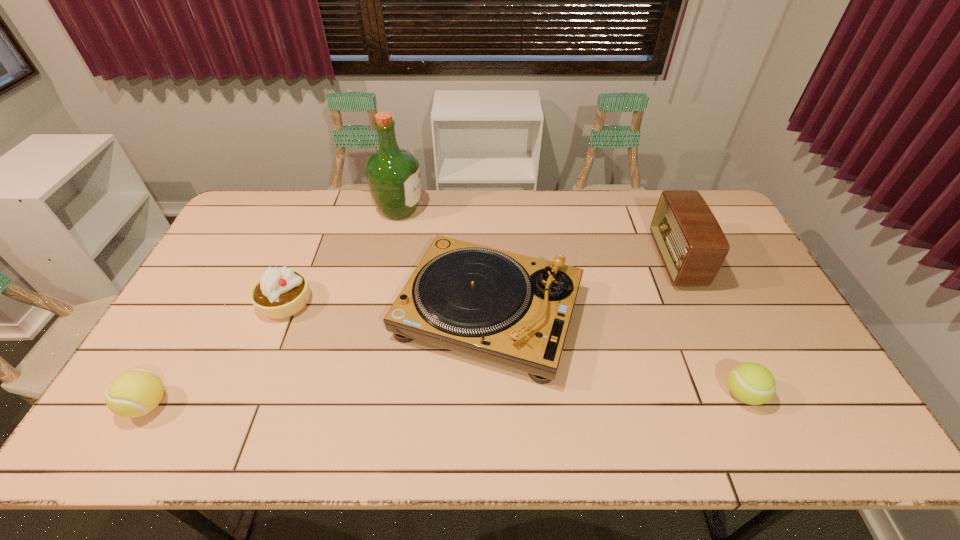
Find the location of `object located at the near left corner`. object located at the near left corner is located at coordinates (134, 393).

Locate an element on the screen. vacant point at the far edge is located at coordinates (607, 204).

You are a GUI agent. You are given a task and a screenshot of the screen. Output one action in this format:
    pyautogui.click(x=<x>, y=<y>)
    Task: Click on the vacant point at the near edge
    
    Given the screenshot: What is the action you would take?
    pyautogui.click(x=274, y=426)

Where is `free point at the left edge`? The height and width of the screenshot is (540, 960). free point at the left edge is located at coordinates (214, 270).

In the image, there is a desktop. At what (x,y) coordinates should I click in order to perform the action: click on free space at the right edge. Please return your answer as a coordinate pair (x, y). Image resolution: width=960 pixels, height=540 pixels. Looking at the image, I should click on (733, 287).

In the image, there is a desktop. Identify the location of blank space at the far left corner. The height and width of the screenshot is (540, 960). (243, 222).

At what (x,y) coordinates should I click in order to perform the action: click on vacant space that is in between the left tennis ball and the whipped cream. Please return your answer as a coordinate pair (x, y). The image size is (960, 540). Looking at the image, I should click on (217, 354).

Where is `unoccupied position between the second tallest object and the third tallest object`? The height and width of the screenshot is (540, 960). unoccupied position between the second tallest object and the third tallest object is located at coordinates (582, 287).

Identify the location of free spot between the right tennis ball and the fifth shortest object. Image resolution: width=960 pixels, height=540 pixels. (709, 327).

Where is `empty location between the whipped cream and the fourth shortest object`? The width and height of the screenshot is (960, 540). empty location between the whipped cream and the fourth shortest object is located at coordinates (387, 308).